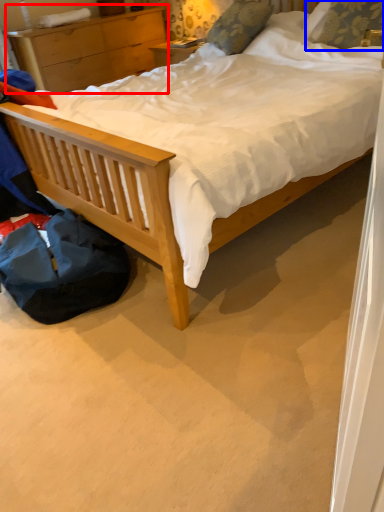
Question: Which of the following is the farthest to the observer, nightstand (highlighted by a red box) or pillow (highlighted by a blue box)?

Choices:
 (A) nightstand
 (B) pillow

Answer: (A)